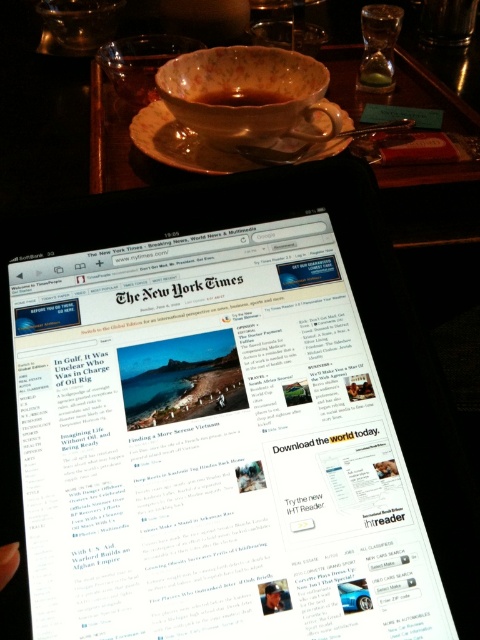
Question: Is matte ceramic saucer at upper center wider than brown matte coffee cup at upper center?

Choices:
 (A) yes
 (B) no

Answer: (A)

Question: Is matte ceramic saucer at upper center positioned in front of brown matte coffee cup at upper center?

Choices:
 (A) yes
 (B) no

Answer: (A)

Question: Can you confirm if matte ceramic saucer at upper center is positioned to the left of brown matte coffee cup at upper center?

Choices:
 (A) yes
 (B) no

Answer: (A)

Question: Among these objects, which one is farthest from the camera?

Choices:
 (A) matte ceramic saucer at upper center
 (B) brown matte coffee cup at upper center

Answer: (B)

Question: Among these objects, which one is farthest from the camera?

Choices:
 (A) brown matte coffee cup at upper center
 (B) matte ceramic saucer at upper center

Answer: (A)